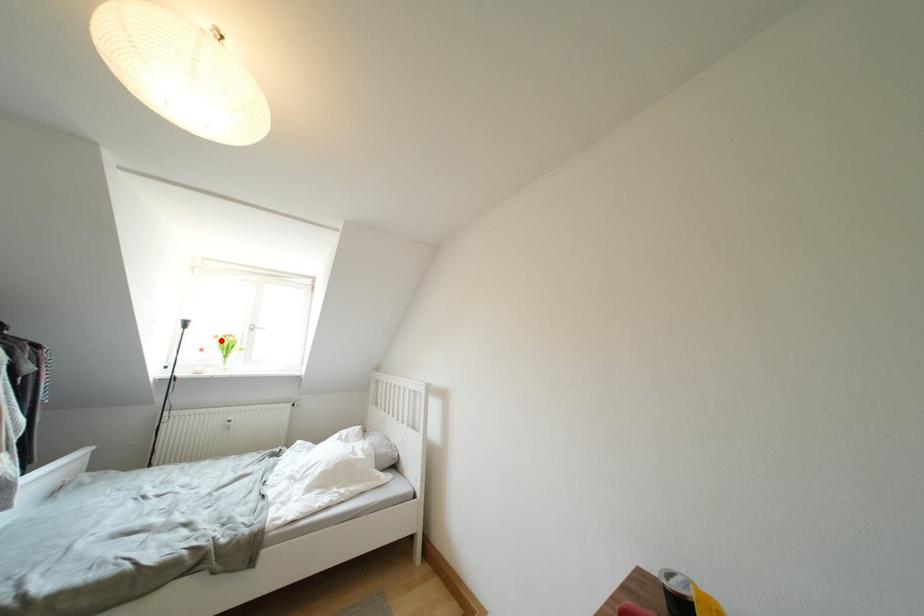
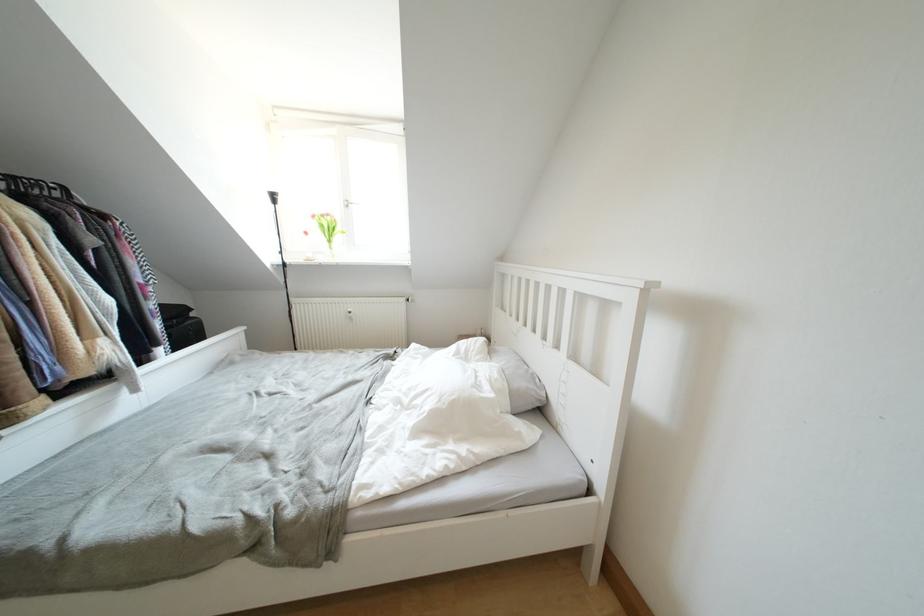
Locate, in the second image, the point that corresponds to the highlighted location in the first image.

(319, 220)